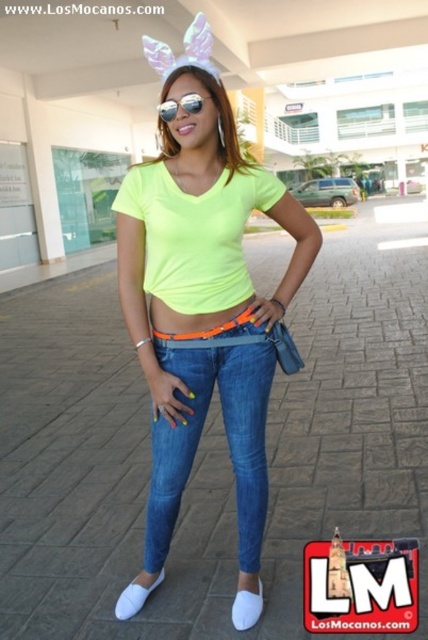
Question: Can you confirm if neon yellow fabric top at center is bigger than white leather shoe at lower center?

Choices:
 (A) yes
 (B) no

Answer: (A)

Question: Can you confirm if white fabric shoe at lower center is wider than sunglasses at center?

Choices:
 (A) no
 (B) yes

Answer: (A)

Question: Estimate the real-world distances between objects in this image. Which object is farther from the sunglasses at center?

Choices:
 (A) denim at center
 (B) white fabric shoe at lower center
 (C) neon yellow fabric top at center

Answer: (B)

Question: Is neon yellow fabric top at center to the left of sunglasses at center from the viewer's perspective?

Choices:
 (A) yes
 (B) no

Answer: (B)

Question: Which object is farther from the camera taking this photo?

Choices:
 (A) neon yellow fabric top at center
 (B) sunglasses at center
 (C) denim at center
 (D) white leather shoe at lower center

Answer: (D)

Question: Among these objects, which one is nearest to the camera?

Choices:
 (A) white fabric shoe at lower center
 (B) sunglasses at center
 (C) white leather shoe at lower center
 (D) denim jeans at center

Answer: (B)